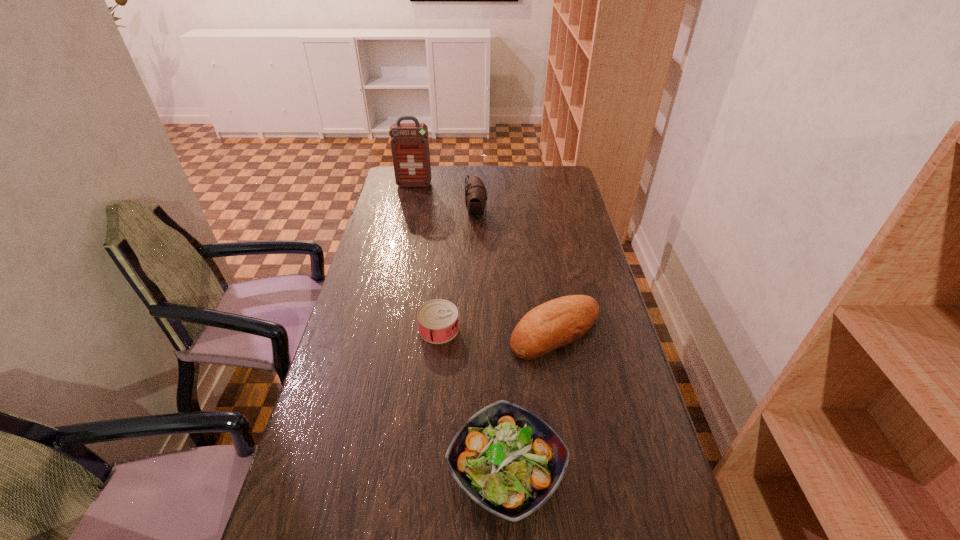
Find the location of `the first-aid kit`. the first-aid kit is located at coordinates (409, 142).

This screenshot has height=540, width=960. I want to click on the leftmost object, so click(x=409, y=142).

The height and width of the screenshot is (540, 960). Find the location of `the second farthest object`. the second farthest object is located at coordinates (475, 192).

This screenshot has width=960, height=540. I want to click on pouch, so click(475, 192).

This screenshot has height=540, width=960. Find the location of `the nearest object`. the nearest object is located at coordinates (510, 461).

The image size is (960, 540). What are the coordinates of `bread` in the screenshot? It's located at (561, 321).

What are the coordinates of `the shortest object` in the screenshot? It's located at (437, 319).

Identify the location of vacant space situated on the front-facing side of the tallest object. Image resolution: width=960 pixels, height=540 pixels. (411, 198).

Image resolution: width=960 pixels, height=540 pixels. What are the coordinates of `vacant area situated 0.080m with the flap open on the pouch` in the screenshot? It's located at (506, 213).

Locate an element on the screen. Image resolution: width=960 pixels, height=540 pixels. vacant area situated 0.100m on the right of the salad plate is located at coordinates (609, 470).